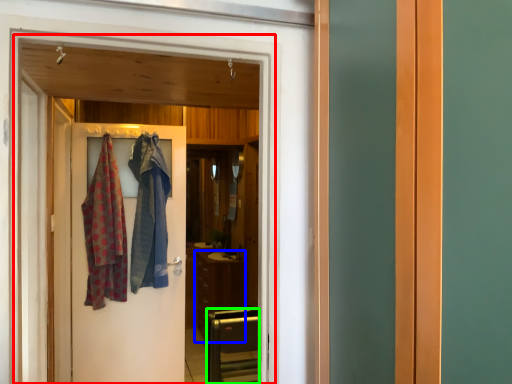
Question: Which object is the farthest from elevator (highlighted by a red box)? Choose among these: cabinetry (highlighted by a blue box) or furniture (highlighted by a green box).

Choices:
 (A) cabinetry
 (B) furniture

Answer: (A)